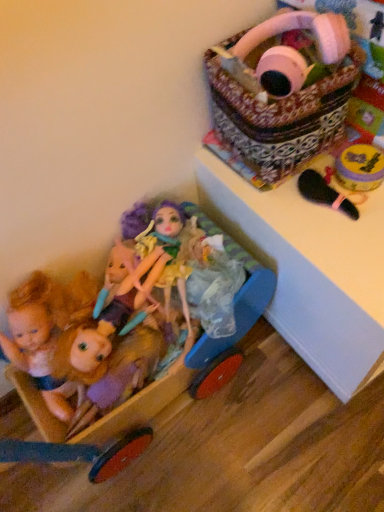
This screenshot has height=512, width=384. Describe the element at coordinates (284, 96) in the screenshot. I see `patterned fabric basket at upper right` at that location.

Where is `white glossy changing table at upper right`? The width and height of the screenshot is (384, 512). white glossy changing table at upper right is located at coordinates (310, 270).

In the scene shown: How much space does matte plastic dolls at lower left, the first doll when ordered from left to right, occupy vertically?

11.66 inches.

Locate an element on the screen. The image size is (384, 512). matte plastic dolls at lower left, the first doll when ordered from left to right is located at coordinates (44, 331).

Image resolution: width=384 pixels, height=512 pixels. Describe the element at coordinates (167, 246) in the screenshot. I see `shiny purple hair at center, which appears as the third doll when viewed from the left` at that location.

Locate an element on the screen. patterned fabric basket at upper right is located at coordinates (284, 96).

In the scene shown: Considering the sizes of objects pastel purple fabric doll at lower left, placed as the 2th doll when sorted from left to right, and wooden baby carriage at lower left in the image provided, who is bigger, pastel purple fabric doll at lower left, placed as the 2th doll when sorted from left to right, or wooden baby carriage at lower left?

wooden baby carriage at lower left is bigger.

You are a GUI agent. You are given a task and a screenshot of the screen. Output one action in this format:
    pyautogui.click(x=<x>, y=<y>)
    Task: Click on the baby carriage that appears on the right of pastel purple fabric doll at lower left, placed as the 2th doll when sorted from left to right
    The image size is (384, 512).
    Given the screenshot: What is the action you would take?
    pyautogui.click(x=239, y=305)

Considering the relative sizes of pastel purple fabric doll at lower left, which is the second doll from right to left, and wooden baby carriage at lower left in the image provided, is pastel purple fabric doll at lower left, which is the second doll from right to left, thinner than wooden baby carriage at lower left?

Indeed, pastel purple fabric doll at lower left, which is the second doll from right to left, has a lesser width compared to wooden baby carriage at lower left.

Is pastel purple fabric doll at lower left, which is the second doll from right to left, outside of wooden baby carriage at lower left?

That's incorrect, pastel purple fabric doll at lower left, which is the second doll from right to left, is not completely outside wooden baby carriage at lower left.

Based on the photo, from the image's perspective, which is above, wooden baby carriage at lower left or shiny purple hair at center, the 1th doll when ordered from right to left?

shiny purple hair at center, the 1th doll when ordered from right to left, is shown above in the image.

Does wooden baby carriage at lower left have a larger size compared to shiny purple hair at center, the 1th doll when ordered from right to left?

Yes, wooden baby carriage at lower left is bigger than shiny purple hair at center, the 1th doll when ordered from right to left.

From a real-world perspective, is wooden baby carriage at lower left below shiny purple hair at center, the 1th doll when ordered from right to left?

Indeed, from a real-world perspective, wooden baby carriage at lower left is positioned beneath shiny purple hair at center, the 1th doll when ordered from right to left.

Does point (269, 281) appear closer or farther from the camera than point (79, 429)?

Point (269, 281).

Is wooden baby carriage at lower left surrounding pastel purple fabric doll at lower left, placed as the 2th doll when sorted from left to right?

Yes, wooden baby carriage at lower left is surrounding pastel purple fabric doll at lower left, placed as the 2th doll when sorted from left to right.

How many degrees apart are the facing directions of wooden baby carriage at lower left and pastel purple fabric doll at lower left, placed as the 2th doll when sorted from left to right?

The facing directions of wooden baby carriage at lower left and pastel purple fabric doll at lower left, placed as the 2th doll when sorted from left to right, are 88 degrees apart.

Considering the positions of objects wooden baby carriage at lower left and pastel purple fabric doll at lower left, placed as the 2th doll when sorted from left to right, in the image provided, who is more to the left, wooden baby carriage at lower left or pastel purple fabric doll at lower left, placed as the 2th doll when sorted from left to right,?

pastel purple fabric doll at lower left, placed as the 2th doll when sorted from left to right, is more to the left.

This screenshot has height=512, width=384. I want to click on changing table behind the wooden baby carriage at lower left, so click(x=310, y=270).

Considering the relative sizes of white glossy changing table at upper right and wooden baby carriage at lower left in the image provided, is white glossy changing table at upper right thinner than wooden baby carriage at lower left?

Incorrect, the width of white glossy changing table at upper right is not less than that of wooden baby carriage at lower left.

How different are the orientations of white glossy changing table at upper right and wooden baby carriage at lower left in degrees?

The angle between the facing direction of white glossy changing table at upper right and the facing direction of wooden baby carriage at lower left is 4.15 degrees.

Can you confirm if white glossy changing table at upper right is positioned to the right of wooden baby carriage at lower left?

Indeed, white glossy changing table at upper right is positioned on the right side of wooden baby carriage at lower left.

From the image's perspective, is matte plastic dolls at lower left, the third doll from the right, above shiny purple hair at center, which appears as the third doll when viewed from the left?

No, from the image's perspective, matte plastic dolls at lower left, the third doll from the right, is not above shiny purple hair at center, which appears as the third doll when viewed from the left.

From a real-world perspective, which is physically below, matte plastic dolls at lower left, the first doll when ordered from left to right, or shiny purple hair at center, which appears as the third doll when viewed from the left?

From a 3D spatial view, matte plastic dolls at lower left, the first doll when ordered from left to right, is below.

Does matte plastic dolls at lower left, the third doll from the right, have a larger size compared to shiny purple hair at center, which appears as the third doll when viewed from the left?

Yes.

Can you confirm if matte plastic dolls at lower left, the first doll when ordered from left to right, is positioned to the left of shiny purple hair at center, which appears as the third doll when viewed from the left?

Correct, you'll find matte plastic dolls at lower left, the first doll when ordered from left to right, to the left of shiny purple hair at center, which appears as the third doll when viewed from the left.

This screenshot has width=384, height=512. Identify the location of changing table behind the patterned fabric basket at upper right. (310, 270).

Is white glossy changing table at upper right far from patterned fabric basket at upper right?

white glossy changing table at upper right is near patterned fabric basket at upper right, not far away.

Is patterned fabric basket at upper right completely or partially inside white glossy changing table at upper right?

No, patterned fabric basket at upper right is not a part of white glossy changing table at upper right.

From the image's perspective, which object appears higher, white glossy changing table at upper right or matte plastic dolls at lower left, the first doll when ordered from left to right?

white glossy changing table at upper right appears higher in the image.

Between white glossy changing table at upper right and matte plastic dolls at lower left, the first doll when ordered from left to right, which one has larger width?

Wider between the two is white glossy changing table at upper right.

Between point (353, 303) and point (36, 284), which one is positioned behind?

The point (36, 284) is farther from the camera.

From the white glossy changing table at upper right, count the 3rd doll to the left and point to it. Please provide its 2D coordinates.

[(44, 331)]

This screenshot has height=512, width=384. Find the location of `doll that is the 2nd one when counting downward from the wooden baby carriage at lower left (from the image's perspective)`. doll that is the 2nd one when counting downward from the wooden baby carriage at lower left (from the image's perspective) is located at coordinates (105, 367).

In the image, there is a shiny purple hair at center, which appears as the third doll when viewed from the left. Where is `baby carriage below it (from a real-world perspective)`? This screenshot has height=512, width=384. baby carriage below it (from a real-world perspective) is located at coordinates (239, 305).

When comparing their distances from white glossy changing table at upper right, does matte plastic dolls at lower left, the third doll from the right, or wooden baby carriage at lower left seem closer?

Among the two, wooden baby carriage at lower left is located nearer to white glossy changing table at upper right.

Which object lies further to the anchor point matte plastic dolls at lower left, the first doll when ordered from left to right, patterned fabric basket at upper right or pastel purple fabric doll at lower left, which is the second doll from right to left?

Based on the image, patterned fabric basket at upper right appears to be further to matte plastic dolls at lower left, the first doll when ordered from left to right.

Based on their spatial positions, is shiny purple hair at center, which appears as the third doll when viewed from the left, or white glossy changing table at upper right closer to pastel purple fabric doll at lower left, placed as the 2th doll when sorted from left to right?

Based on the image, shiny purple hair at center, which appears as the third doll when viewed from the left, appears to be nearer to pastel purple fabric doll at lower left, placed as the 2th doll when sorted from left to right.

Which object lies further to the anchor point patterned fabric basket at upper right, white glossy changing table at upper right or pastel purple fabric doll at lower left, placed as the 2th doll when sorted from left to right?

Based on the image, pastel purple fabric doll at lower left, placed as the 2th doll when sorted from left to right, appears to be further to patterned fabric basket at upper right.

Looking at the image, which one is located further to shiny purple hair at center, the 1th doll when ordered from right to left, patterned fabric basket at upper right or matte plastic dolls at lower left, the third doll from the right?

patterned fabric basket at upper right is positioned further to the anchor shiny purple hair at center, the 1th doll when ordered from right to left.

Considering their positions, is white glossy changing table at upper right positioned closer to shiny purple hair at center, the 1th doll when ordered from right to left, than wooden baby carriage at lower left?

wooden baby carriage at lower left is closer to shiny purple hair at center, the 1th doll when ordered from right to left.

Based on their spatial positions, is white glossy changing table at upper right or matte plastic dolls at lower left, the third doll from the right, further from patterned fabric basket at upper right?

matte plastic dolls at lower left, the third doll from the right.

Based on their spatial positions, is pastel purple fabric doll at lower left, which is the second doll from right to left, or wooden baby carriage at lower left further from matte plastic dolls at lower left, the first doll when ordered from left to right?

Among the two, wooden baby carriage at lower left is located further to matte plastic dolls at lower left, the first doll when ordered from left to right.

In order to click on basket between shiny purple hair at center, which appears as the third doll when viewed from the left, and white glossy changing table at upper right from left to right in this screenshot , I will do `click(284, 96)`.

Identify the location of doll between shiny purple hair at center, which appears as the third doll when viewed from the left, and pastel purple fabric doll at lower left, which is the second doll from right to left, vertically. The width and height of the screenshot is (384, 512). (44, 331).

Where is `doll between wooden baby carriage at lower left and white glossy changing table at upper right from left to right`? doll between wooden baby carriage at lower left and white glossy changing table at upper right from left to right is located at coordinates (167, 246).

Find the location of a particular element. doll between wooden baby carriage at lower left and pastel purple fabric doll at lower left, placed as the 2th doll when sorted from left to right, from front to back is located at coordinates coord(44,331).